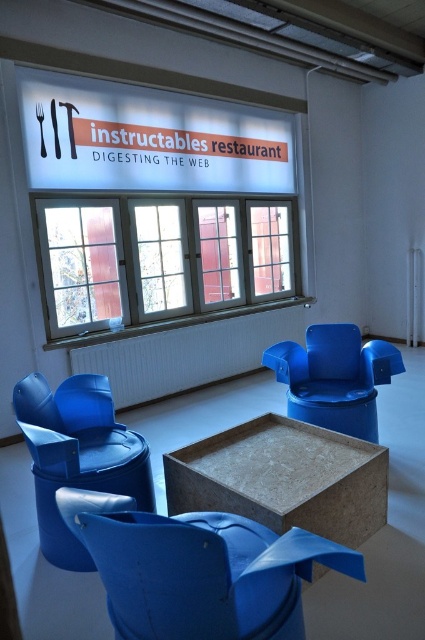
Does clear glass window at center have a greater height compared to matte blue armchair at lower left?

Correct, clear glass window at center is much taller as matte blue armchair at lower left.

Which is more to the right, clear glass window at center or matte blue armchair at lower left?

From the viewer's perspective, clear glass window at center appears more on the right side.

Find the location of `clear glass window at center`. clear glass window at center is located at coordinates (161, 260).

Which is more to the left, clear glass window at center or brown cardboard table at center?

From the viewer's perspective, clear glass window at center appears more on the left side.

Can you confirm if clear glass window at center is positioned below brown cardboard table at center?

No.

Locate an element on the screen. clear glass window at center is located at coordinates (161, 260).

Does clear glass window at center appear over matte blue armchair at center?

Yes.

Does point (71, 253) lie behind point (295, 529)?

That is True.

Is point (76, 262) closer to viewer compared to point (122, 604)?

No, it is not.

This screenshot has width=425, height=640. I want to click on clear glass window at center, so point(161,260).